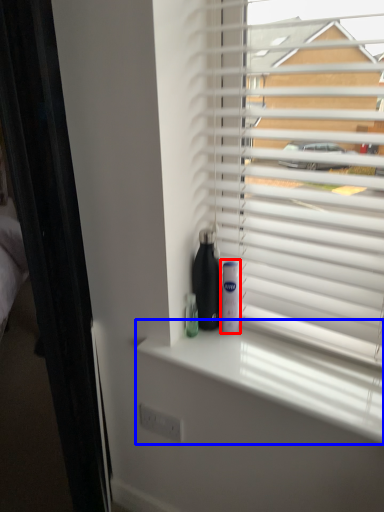
Question: Which of the following is the farthest to the observer, mouthwash (highlighted by a red box) or window sill (highlighted by a blue box)?

Choices:
 (A) mouthwash
 (B) window sill

Answer: (A)